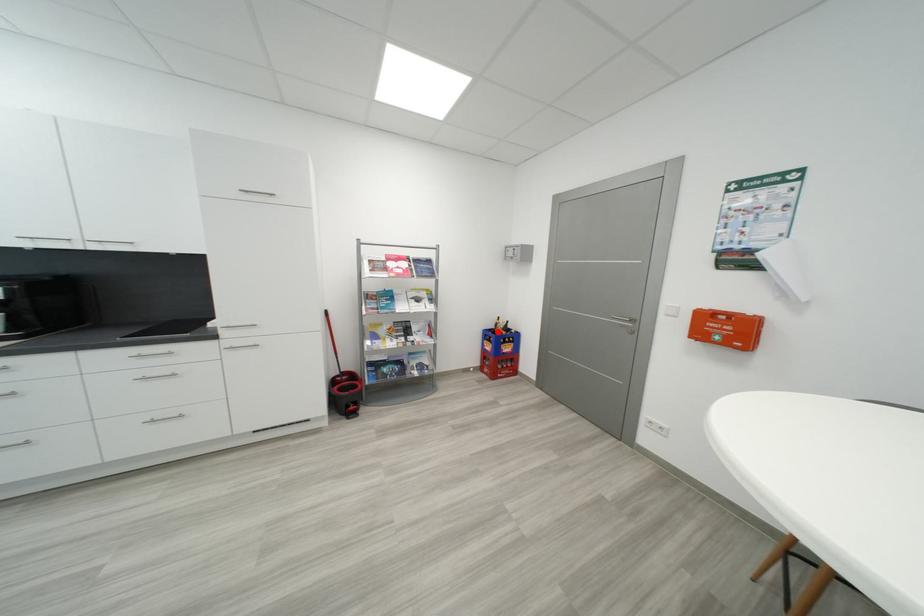
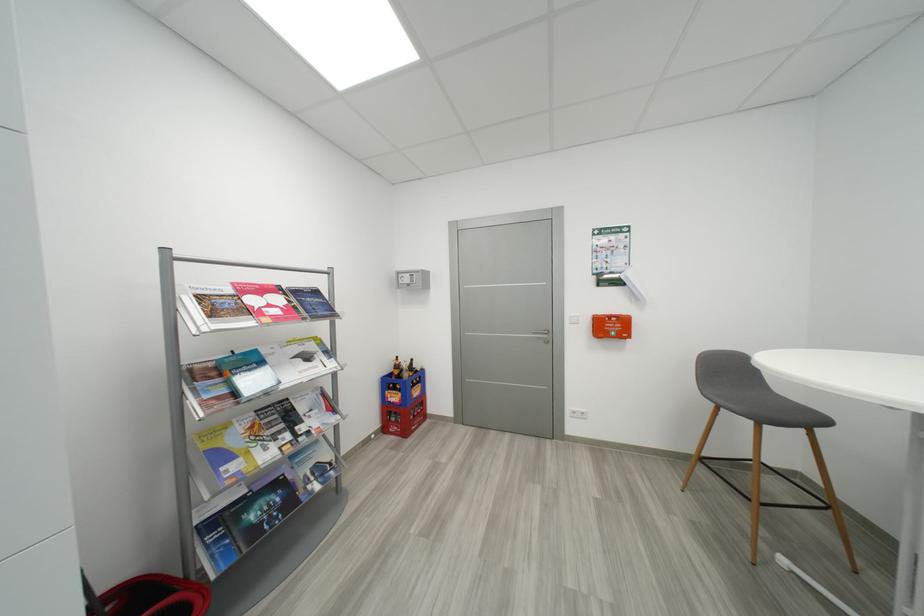
The point at the highlighted location is marked in the first image. Where is the corresponding point in the second image?

(397, 377)